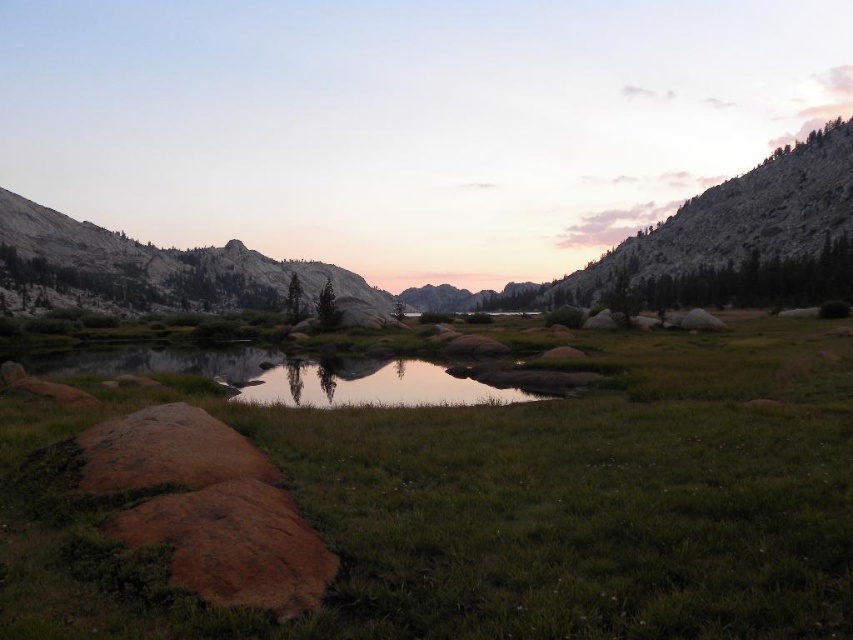
Between point (91, 276) and point (154, 349), which one is positioned behind?

The point (91, 276) is more distant.

Which of these two, granite rock formation at upper left or clear water at center, stands shorter?

With less height is clear water at center.

Locate an element on the screen. granite rock formation at upper left is located at coordinates (155, 269).

Where is `granite rock formation at upper left`? This screenshot has height=640, width=853. granite rock formation at upper left is located at coordinates (155, 269).

Who is higher up, green grassy at lower left or clear water at center?

clear water at center is above.

Is point (807, 595) farther from viewer compared to point (236, 388)?

No, (807, 595) is in front of (236, 388).

You are a GUI agent. You are given a task and a screenshot of the screen. Output one action in this format:
    pyautogui.click(x=<x>, y=<y>)
    Task: Click on the green grassy at lower left
    The width and height of the screenshot is (853, 640).
    Given the screenshot: What is the action you would take?
    tap(505, 509)

Who is more forward, [598,577] or [21,198]?

Positioned in front is point [598,577].

From the picture: Which is below, green grassy at lower left or granite rock formation at upper left?

green grassy at lower left

Locate an element on the screen. This screenshot has height=640, width=853. green grassy at lower left is located at coordinates (505, 509).